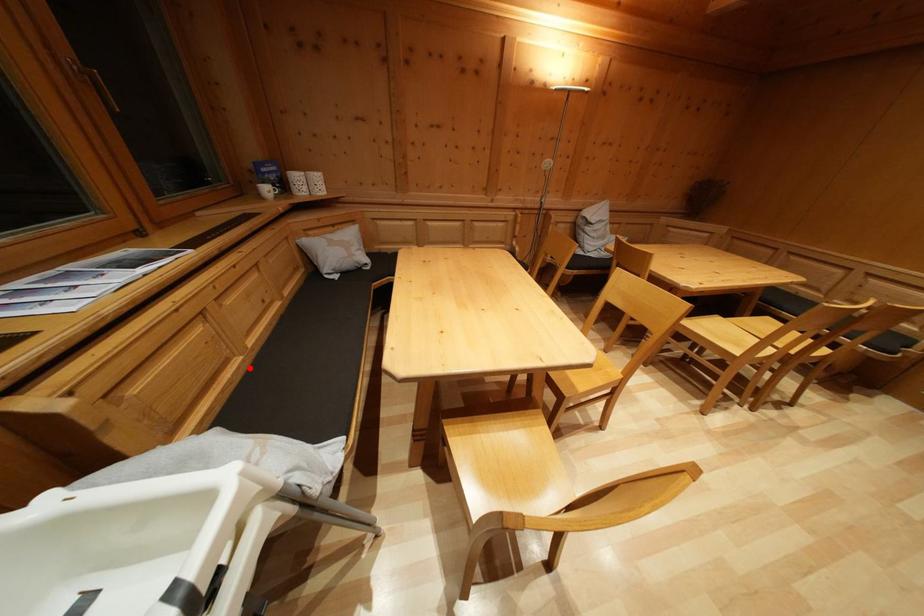
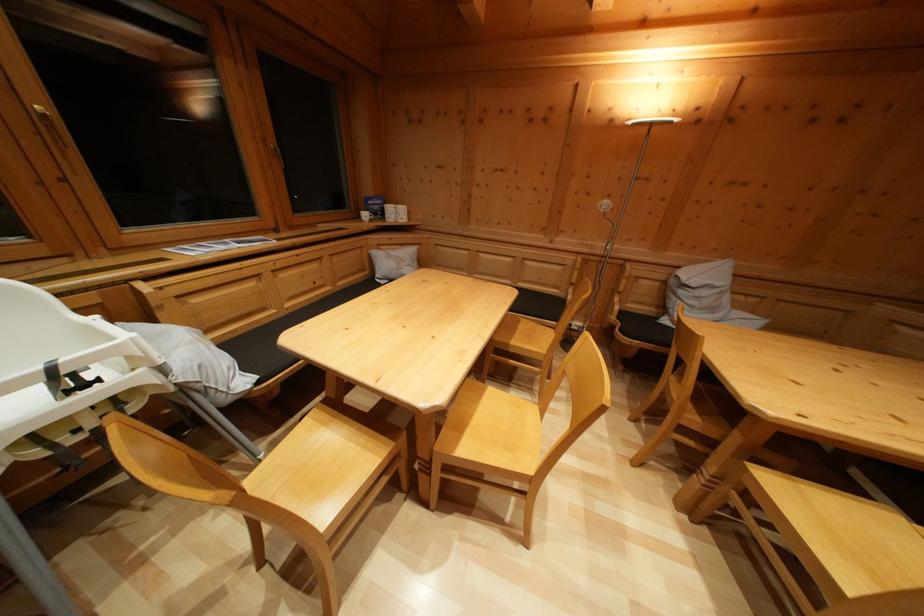
Find the pixel in the second image that matches the highlighted location in the first image.

(282, 321)